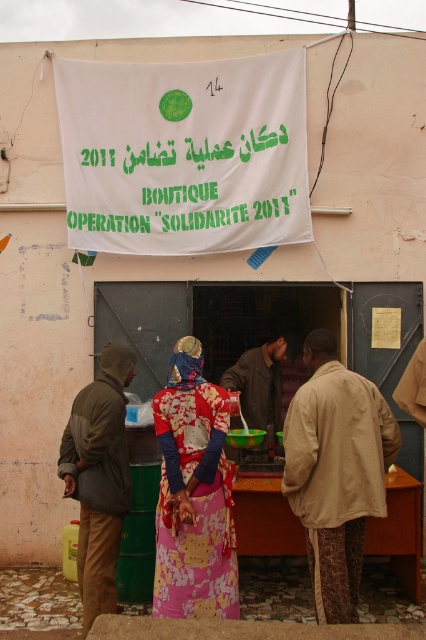
Question: Which point is closer to the camera?

Choices:
 (A) (120, 394)
 (B) (354, 509)
 (C) (279, 356)
 (D) (175, 419)

Answer: (B)

Question: Estimate the real-world distances between objects in this image. Which object is farther from the dark brown leather jacket at center?

Choices:
 (A) printed fabric dress at center
 (B) beige fabric jacket at center

Answer: (B)

Question: Is dark green hooded jacket at left positioned before dark brown leather jacket at center?

Choices:
 (A) yes
 (B) no

Answer: (A)

Question: Is printed fabric dress at center below dark brown leather jacket at center?

Choices:
 (A) yes
 (B) no

Answer: (A)

Question: Where is beige fabric jacket at center located in relation to dark green hooded jacket at left in the image?

Choices:
 (A) left
 (B) right

Answer: (B)

Question: Based on their relative distances, which object is farther from the printed fabric dress at center?

Choices:
 (A) beige fabric jacket at center
 (B) dark green hooded jacket at left

Answer: (A)